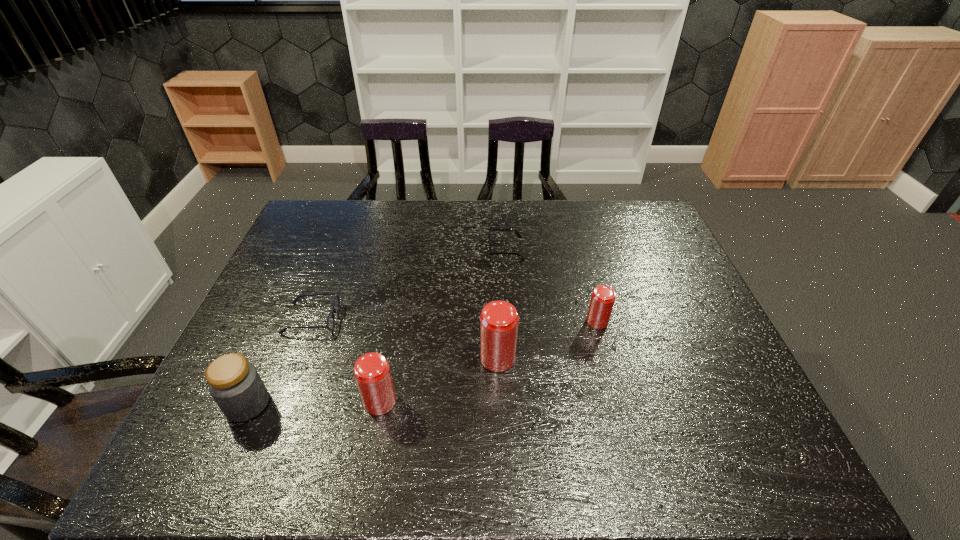
The image size is (960, 540). In order to click on the second closest object to the rightmost beer can in this screenshot , I will do `click(490, 229)`.

Find the location of a particular element. The image size is (960, 540). beer can that is the second closest to the second beer can from right to left is located at coordinates (603, 297).

Locate which beer can is the closest to the rightmost beer can. Please provide its 2D coordinates. Your answer should be formatted as a tuple, i.e. [(x, y)], where the tuple contains the x and y coordinates of a point satisfying the conditions above.

[(499, 320)]

The width and height of the screenshot is (960, 540). In order to click on free space that satisfies the following two spatial constraints: 1. on the back side of the nearest beer can; 2. on the left side of the second nearest beer can in this screenshot , I will do `click(388, 358)`.

Where is `blank area in the image that satisfies the following two spatial constraints: 1. on the front-facing side of the spectacles; 2. on the left side of the tallest object`? This screenshot has width=960, height=540. blank area in the image that satisfies the following two spatial constraints: 1. on the front-facing side of the spectacles; 2. on the left side of the tallest object is located at coordinates (297, 358).

Image resolution: width=960 pixels, height=540 pixels. I want to click on free spot that satisfies the following two spatial constraints: 1. on the front-facing side of the spectacles; 2. on the right side of the rightmost object, so click(310, 321).